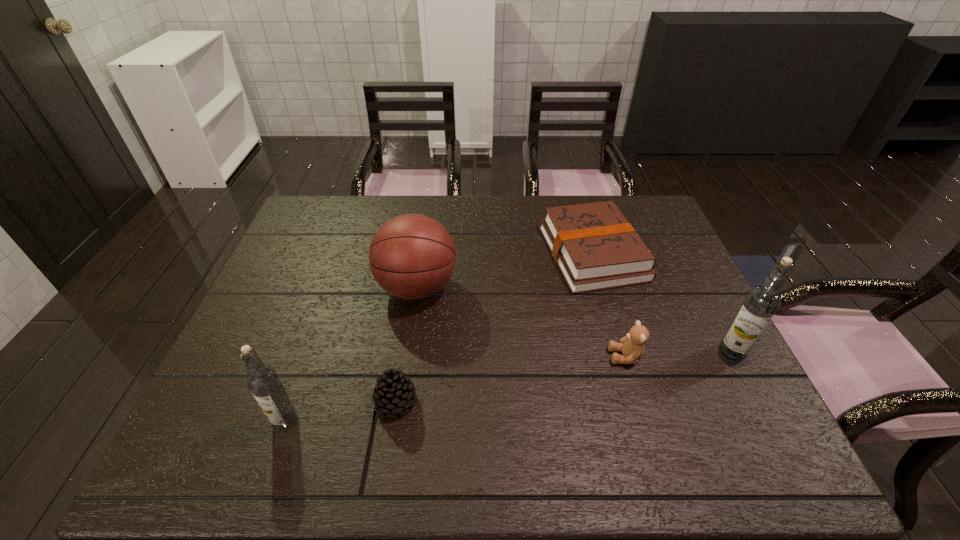
Locate an element on the screen. The height and width of the screenshot is (540, 960). vacant space that's between the left vodka and the shortest object is located at coordinates (439, 337).

The height and width of the screenshot is (540, 960). I want to click on free space between the taller vodka and the basketball, so click(575, 320).

Locate an element on the screen. This screenshot has width=960, height=540. blank region between the hardback book and the leftmost object is located at coordinates (439, 337).

Identify the location of empty space between the pinecone and the right vodka. (564, 376).

I want to click on vacant area that lies between the teddy bear and the shortest object, so click(609, 305).

In order to click on vacant area that lies between the teddy bear and the hardback book in this screenshot , I will do `click(609, 305)`.

Image resolution: width=960 pixels, height=540 pixels. Identify the location of vacant space that's between the rightmost object and the teddy bear. (679, 354).

The image size is (960, 540). In order to click on blank region between the teddy bear and the basketball in this screenshot , I will do `click(521, 322)`.

I want to click on object that is the second closest to the right vodka, so [x=632, y=347].

Point out which object is positioned as the third nearest to the shortest object. Please provide its 2D coordinates. Your answer should be formatted as a tuple, i.e. [(x, y)], where the tuple contains the x and y coordinates of a point satisfying the conditions above.

[(412, 256)]